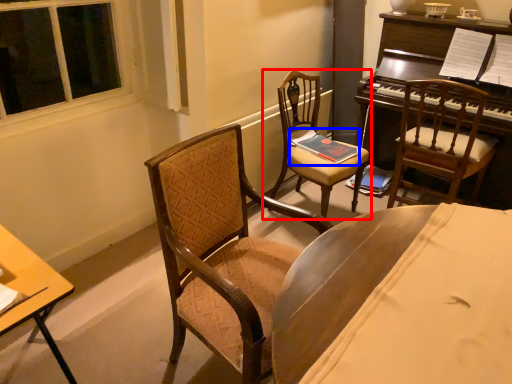
Question: Which of the following is the closest to the observer, chair (highlighted by a red box) or book (highlighted by a blue box)?

Choices:
 (A) chair
 (B) book

Answer: (A)